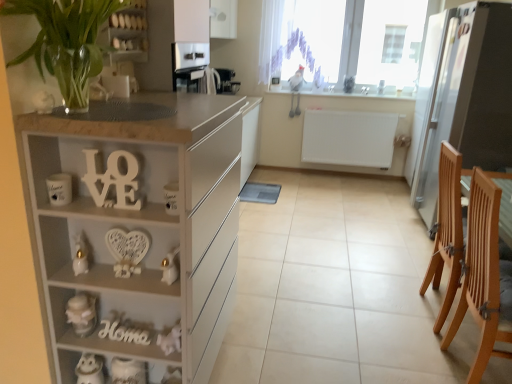
Question: From a real-world perspective, is transparent glass window at upper center on top of white matte jar at lower left, which appears as the 3th toy when viewed from the right?

Choices:
 (A) yes
 (B) no

Answer: (A)

Question: Is the position of transparent glass window at upper center more distant than that of white matte jar at lower left, which appears as the 3th toy when viewed from the right?

Choices:
 (A) yes
 (B) no

Answer: (A)

Question: Considering the relative sizes of transparent glass window at upper center and white matte jar at lower left, placed as the first toy when sorted from left to right, in the image provided, is transparent glass window at upper center wider than white matte jar at lower left, placed as the first toy when sorted from left to right,?

Choices:
 (A) yes
 (B) no

Answer: (A)

Question: Can you confirm if transparent glass window at upper center is thinner than white matte jar at lower left, placed as the first toy when sorted from left to right?

Choices:
 (A) no
 (B) yes

Answer: (A)

Question: From the image's perspective, is transparent glass window at upper center below white matte jar at lower left, placed as the first toy when sorted from left to right?

Choices:
 (A) yes
 (B) no

Answer: (B)

Question: From a real-world perspective, is satin black coffee machine at upper center, the 4th appliance in the front-to-back sequence, physically located above or below white glossy rabbit at left, marked as the second toy in a left-to-right arrangement?

Choices:
 (A) above
 (B) below

Answer: (A)

Question: Is satin black coffee machine at upper center, which is the 1th appliance in top-to-bottom order, situated inside white glossy rabbit at left, marked as the second toy in a left-to-right arrangement, or outside?

Choices:
 (A) outside
 (B) inside

Answer: (A)

Question: In terms of height, does satin black coffee machine at upper center, the 1th appliance in the back-to-front sequence, look taller or shorter compared to white glossy rabbit at left, marked as the 2th toy in a right-to-left arrangement?

Choices:
 (A) tall
 (B) short

Answer: (A)

Question: Does point (223, 89) appear closer or farther from the camera than point (79, 243)?

Choices:
 (A) farther
 (B) closer

Answer: (A)

Question: Looking at the image, does white wood love sign at center, which is the second alphabet in bottom-to-top order, seem bigger or smaller compared to white sheer curtain at upper center?

Choices:
 (A) small
 (B) big

Answer: (A)

Question: Considering their positions, is white wood love sign at center, which is the second alphabet in bottom-to-top order, located in front of or behind white sheer curtain at upper center?

Choices:
 (A) front
 (B) behind

Answer: (A)

Question: Considering the positions of point (90, 155) and point (320, 77), is point (90, 155) closer or farther from the camera than point (320, 77)?

Choices:
 (A) closer
 (B) farther

Answer: (A)

Question: From a real-world perspective, is white wood love sign at center, arranged as the 1th alphabet when viewed from the top, physically located above or below white sheer curtain at upper center?

Choices:
 (A) above
 (B) below

Answer: (B)

Question: Is white matte cabinet at left wider or thinner than white ceramic owl at lower left, the first appliance viewed from the left?

Choices:
 (A) wide
 (B) thin

Answer: (A)

Question: Considering the positions of point (180, 220) and point (83, 377), is point (180, 220) closer or farther from the camera than point (83, 377)?

Choices:
 (A) farther
 (B) closer

Answer: (B)